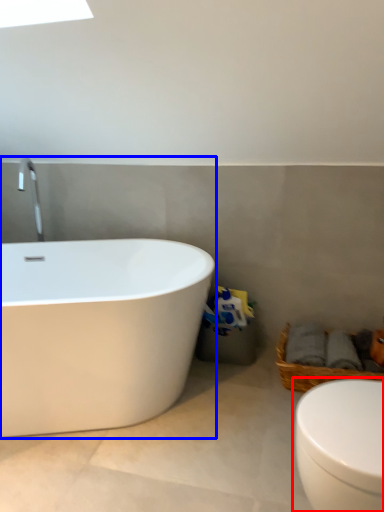
Question: Which object is closer to the camera taking this photo, toilet (highlighted by a red box) or bathtub (highlighted by a blue box)?

Choices:
 (A) toilet
 (B) bathtub

Answer: (A)